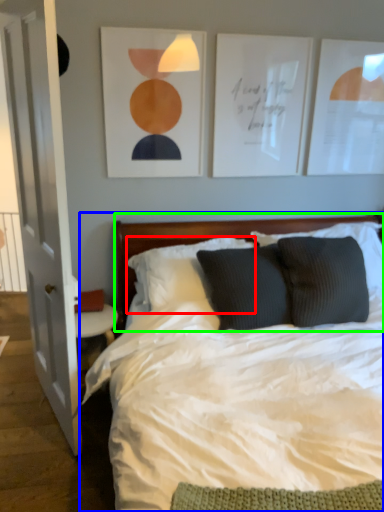
Question: Which object is the farthest from pillow (highlighted by a red box)? Choose among these: bed (highlighted by a blue box) or headboard (highlighted by a green box).

Choices:
 (A) bed
 (B) headboard

Answer: (A)